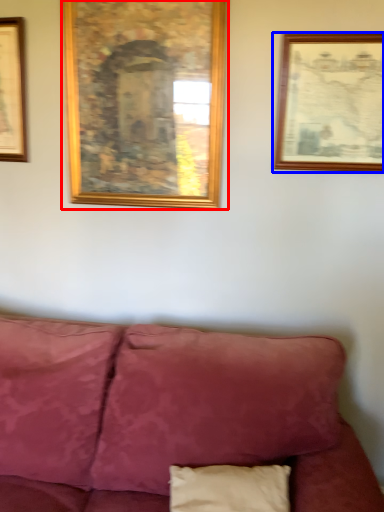
Question: Among these objects, which one is nearest to the camera, picture frame (highlighted by a red box) or picture frame (highlighted by a blue box)?

Choices:
 (A) picture frame
 (B) picture frame

Answer: (B)